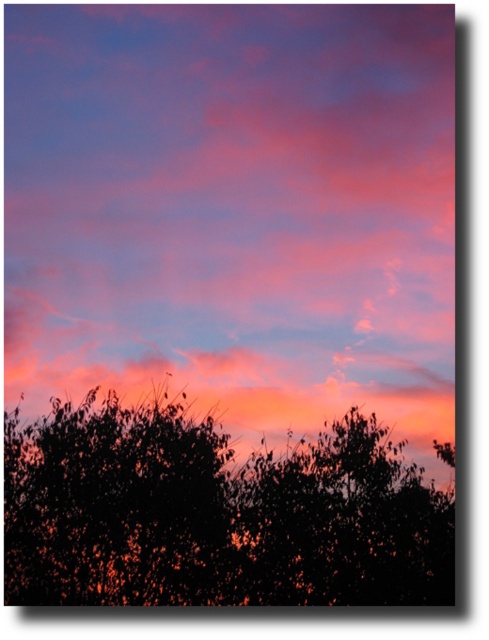
You are an artist painting this sunset scene. You want to ensure the pink cotton candy cloud at upper center and the black leafy tree at bottom are proportionally accurate. Which object should you paint to be taller?

The pink cotton candy cloud at upper center should be painted taller than the black leafy tree at bottom because the description states it is taller.

You are a photographer standing at the camera position. You want to capture a closeup shot of the pink cotton candy cloud at upper center. Based on the scene description, can you estimate if you need to move closer or stay at your current position to get a better closeup?

The pink cotton candy cloud at upper center is 24.68 meters away from the camera. To get a closer shot, you would need to move closer to reduce the distance between the camera and the cloud.